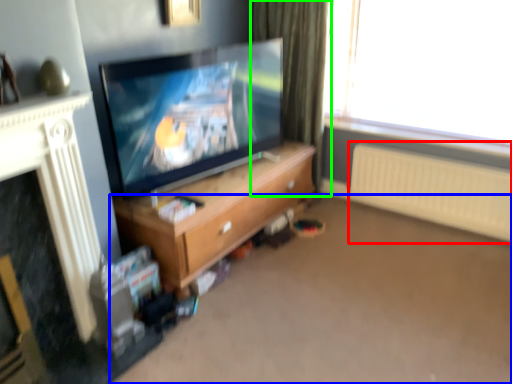
Question: Considering the real-world distances, which object is farthest from radiator (highlighted by a red box)? plain (highlighted by a blue box) or curtain (highlighted by a green box)?

Choices:
 (A) plain
 (B) curtain

Answer: (B)